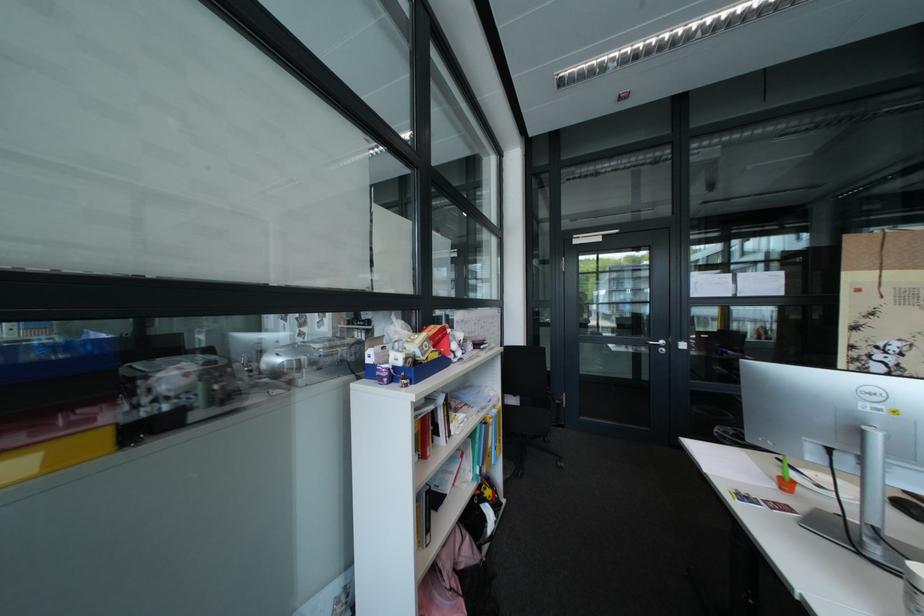
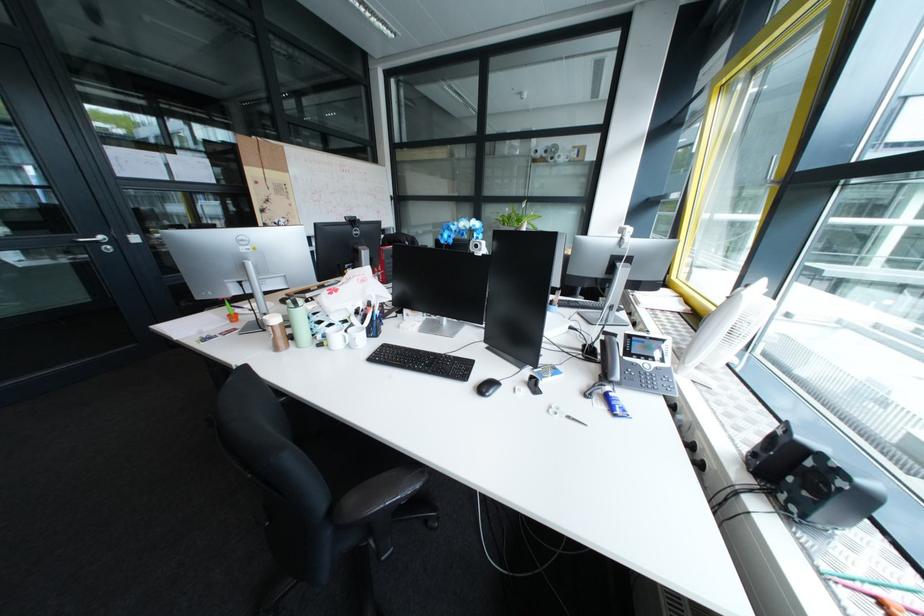
The point at (672,342) is marked in the first image. Where is the corresponding point in the second image?

(107, 238)